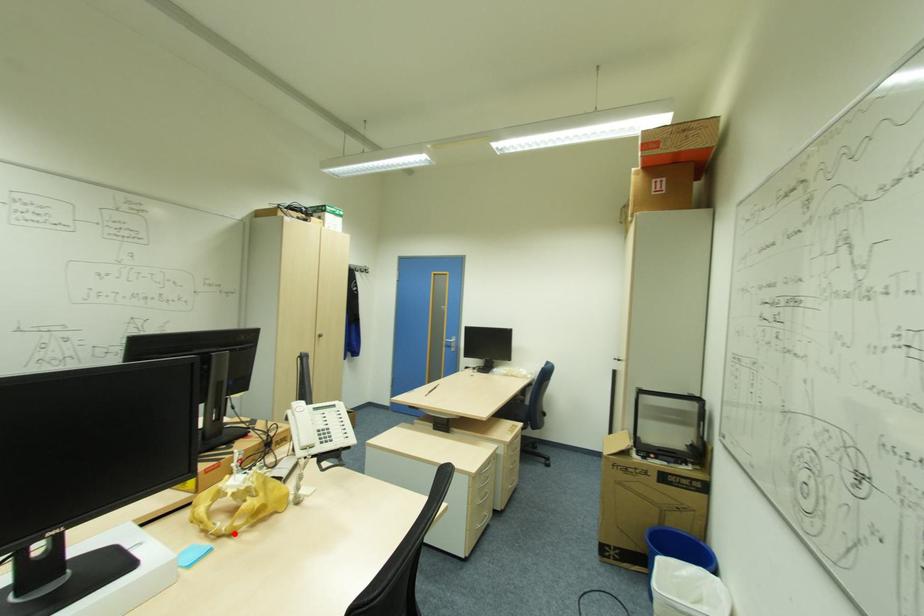
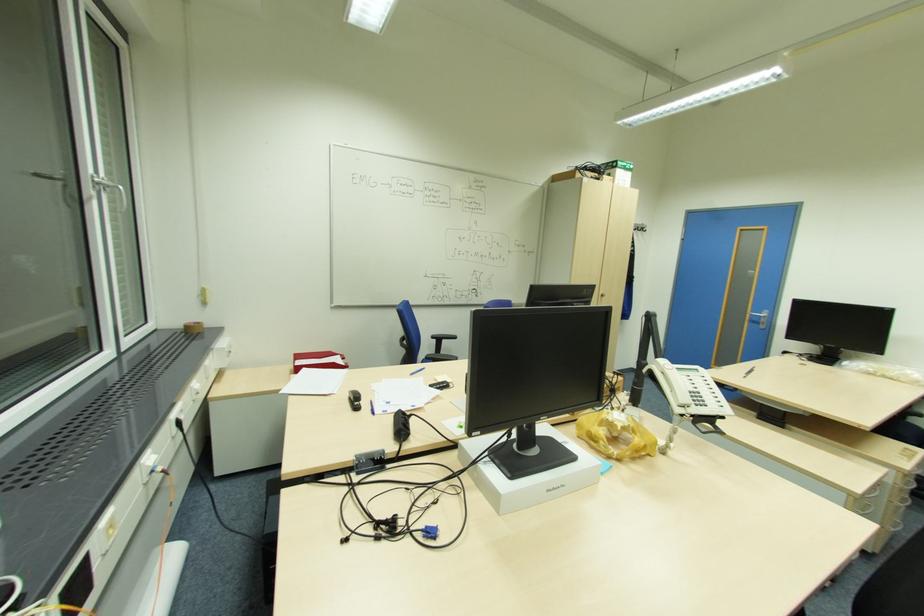
In the second image, find the point that corresponds to the highlighted location in the first image.

(621, 459)